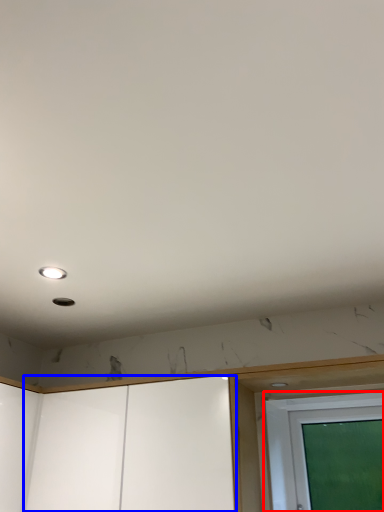
Question: Which object is further to the camera taking this photo, screen door (highlighted by a red box) or screen door (highlighted by a blue box)?

Choices:
 (A) screen door
 (B) screen door

Answer: (A)